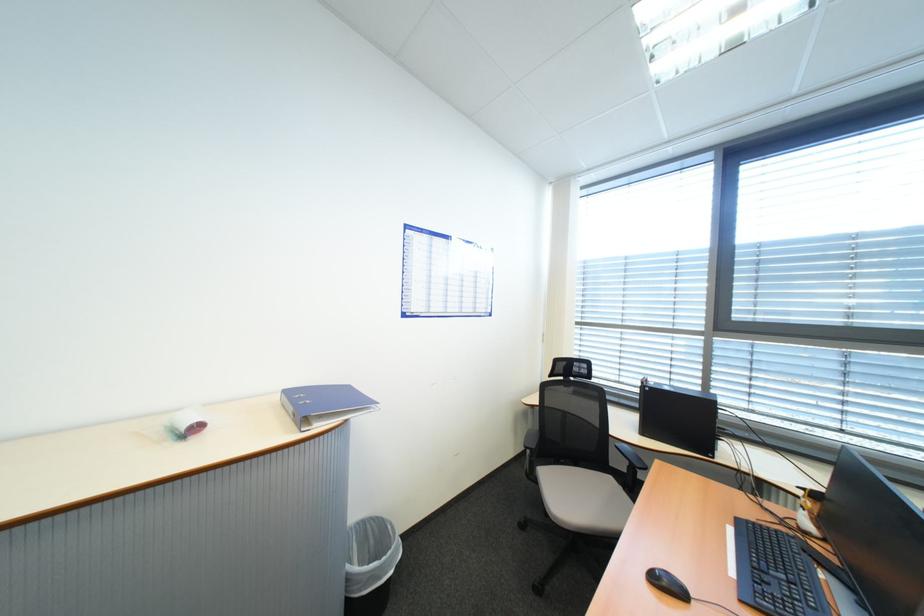
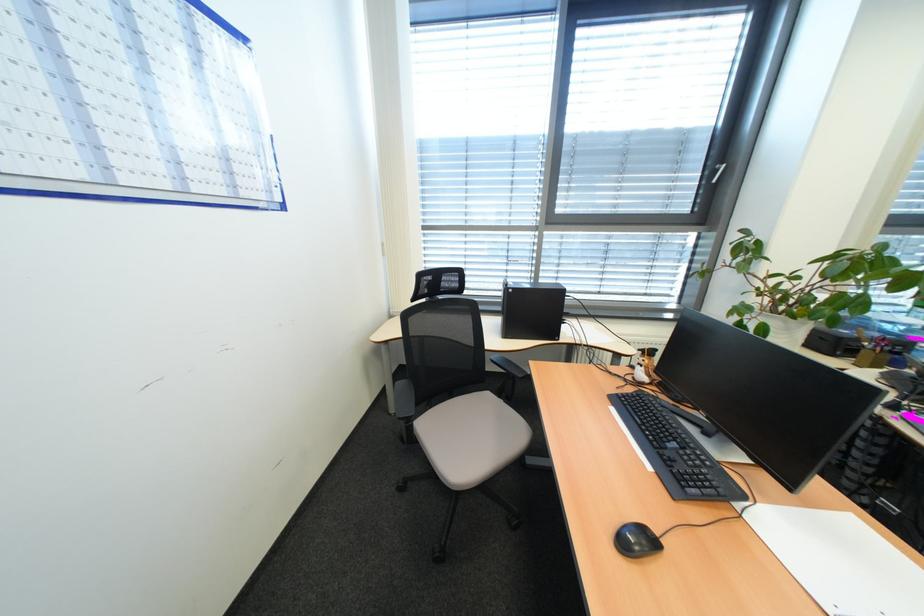
In the second image, find the point that corresponds to (822,511) in the first image.

(659, 366)